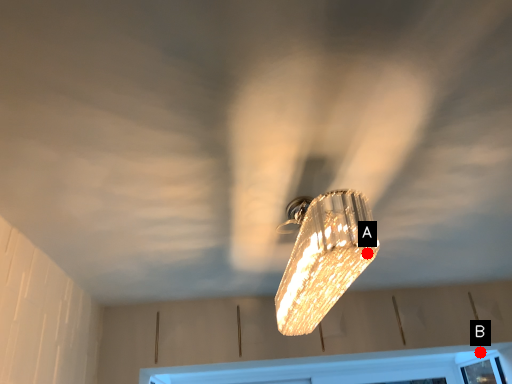
Question: Two points are circled on the image, labeled by A and B beside each circle. Which point appears farthest from the camera in this image?

Choices:
 (A) A is further
 (B) B is further

Answer: (B)